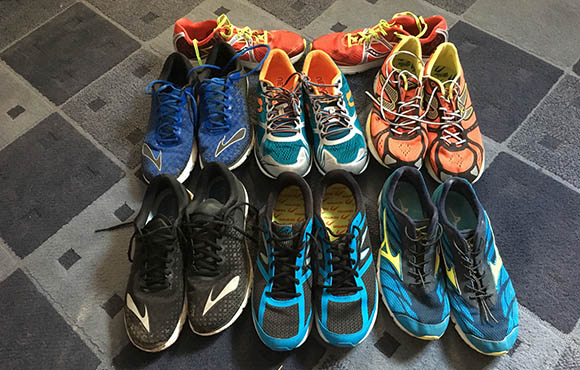
The image size is (580, 370). Find the location of `medium gray carpet tile`. medium gray carpet tile is located at coordinates click(x=36, y=14), click(x=152, y=16), click(x=311, y=8), click(x=132, y=104), click(x=557, y=134).